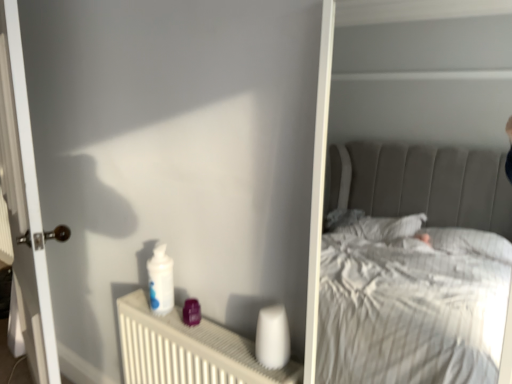
Question: Considering the positions of white plastic radiator at lower center and white glossy door at left in the image, is white plastic radiator at lower center taller or shorter than white glossy door at left?

Choices:
 (A) tall
 (B) short

Answer: (B)

Question: In the image, is white plastic radiator at lower center positioned in front of or behind white glossy door at left?

Choices:
 (A) behind
 (B) front

Answer: (B)

Question: From a real-world perspective, is white plastic radiator at lower center physically located above or below white glossy door at left?

Choices:
 (A) below
 (B) above

Answer: (A)

Question: Considering the positions of white glossy door at left and white plastic radiator at lower center in the image, is white glossy door at left taller or shorter than white plastic radiator at lower center?

Choices:
 (A) tall
 (B) short

Answer: (A)

Question: Is white glossy door at left to the left or to the right of white plastic radiator at lower center in the image?

Choices:
 (A) right
 (B) left

Answer: (B)

Question: Based on their sizes in the image, would you say white glossy door at left is bigger or smaller than white plastic radiator at lower center?

Choices:
 (A) small
 (B) big

Answer: (B)

Question: From the image's perspective, is white glossy door at left positioned above or below white plastic radiator at lower center?

Choices:
 (A) below
 (B) above

Answer: (B)